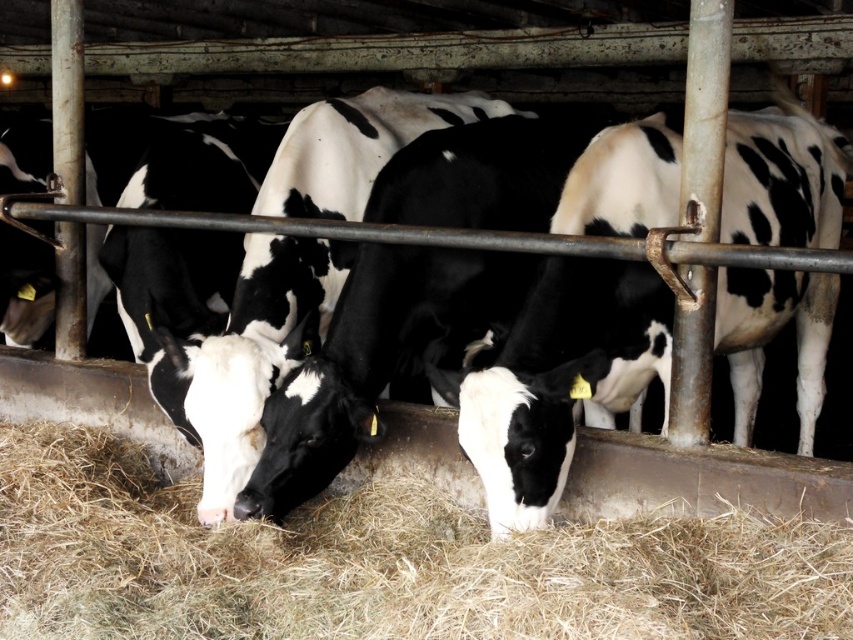
Question: Can you confirm if brown dry hay at center is positioned to the right of black and white cow at center?

Choices:
 (A) yes
 (B) no

Answer: (B)

Question: Does brown dry hay at center appear over black and white cow at center?

Choices:
 (A) no
 (B) yes

Answer: (A)

Question: Which of the following is the farthest from the observer?

Choices:
 (A) (22, 531)
 (B) (199, 218)

Answer: (B)

Question: Which point is closer to the camera taking this photo?

Choices:
 (A) (817, 230)
 (B) (637, 531)

Answer: (B)

Question: Does brown dry hay at center appear over black and white cow at center?

Choices:
 (A) yes
 (B) no

Answer: (B)